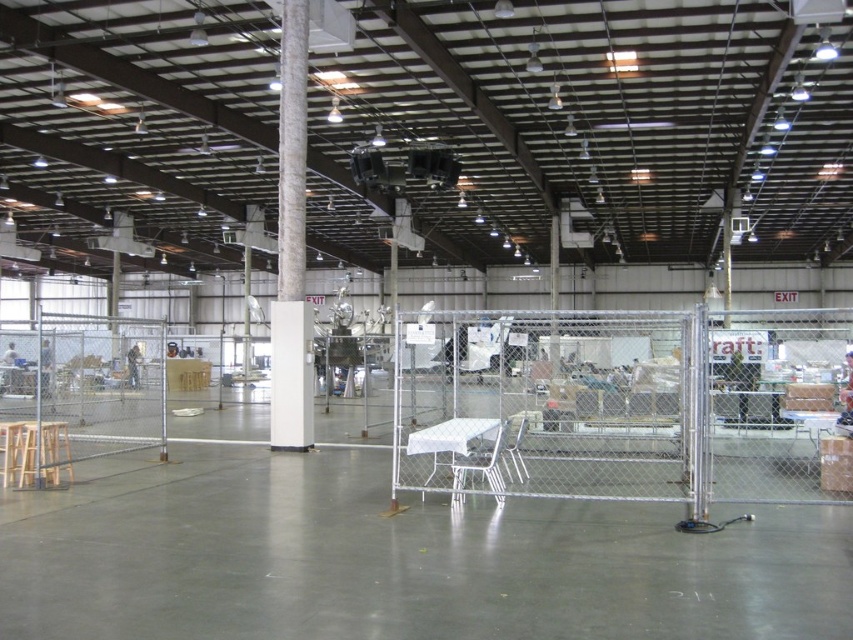
Question: Does wooden stool at lower left appear on the right side of light brown wooden stool at lower left?

Choices:
 (A) yes
 (B) no

Answer: (A)

Question: Is white plastic chair at center further to camera compared to metallic silver chair at center?

Choices:
 (A) yes
 (B) no

Answer: (B)

Question: Among these objects, which one is farthest from the camera?

Choices:
 (A) silver chain-link fence at center
 (B) metallic silver chair at center
 (C) metallic chain-link fence at center
 (D) wooden stool at lower left

Answer: (D)

Question: Which point is closer to the camera?

Choices:
 (A) (292, 298)
 (B) (519, 476)
 (C) (120, 369)
 (D) (38, 468)

Answer: (D)

Question: Does silver chain-link fence at center appear on the right side of white plastic chair at center?

Choices:
 (A) yes
 (B) no

Answer: (A)

Question: Considering the real-world distances, which object is farthest from the wooden stool at lower left?

Choices:
 (A) white textured column at center
 (B) metallic chain-link fence at center

Answer: (A)